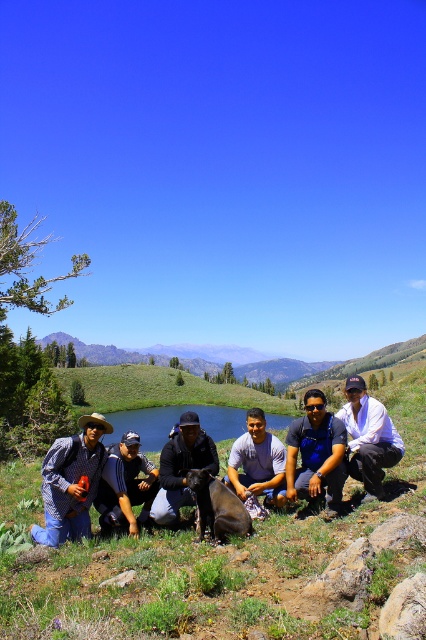
Question: Does plaid shirt at lower left have a smaller size compared to dark blue jacket at center?

Choices:
 (A) no
 (B) yes

Answer: (A)

Question: Among these objects, which one is nearest to the camera?

Choices:
 (A) dark blue jacket at center
 (B) green grass at center

Answer: (B)

Question: Is plaid shirt at lower left to the left of gray cotton shirt at center from the viewer's perspective?

Choices:
 (A) yes
 (B) no

Answer: (A)

Question: Which point is closer to the camera?

Choices:
 (A) green grassy lake at center
 (B) dark blue jacket at center
 (C) gray cotton shirt at center

Answer: (B)

Question: Which object is the farthest from the green grassy lake at center?

Choices:
 (A) green grass at center
 (B) blue fabric shirt at center
 (C) dark blue shirt at center

Answer: (C)

Question: Is plaid shirt at lower left behind dark blue jacket at center?

Choices:
 (A) yes
 (B) no

Answer: (A)